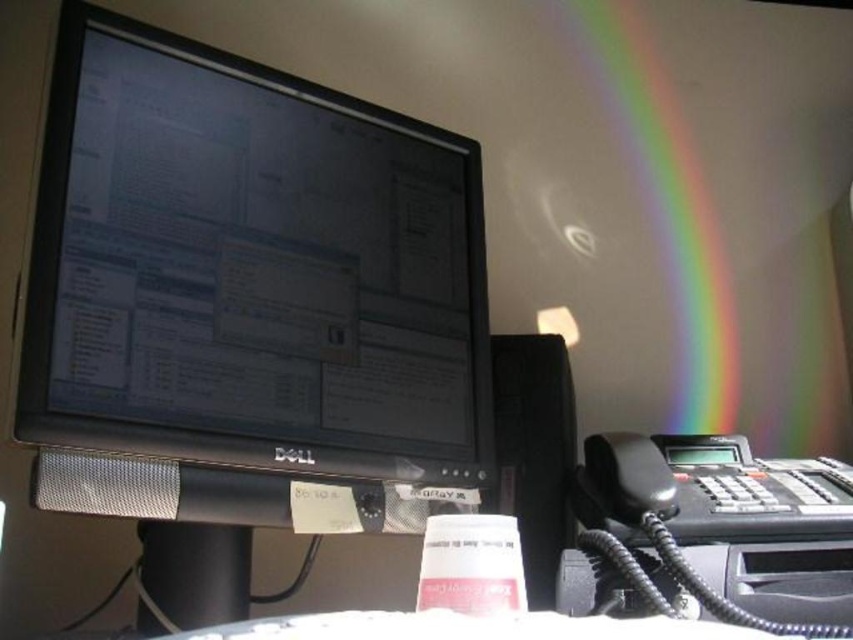
Question: Is black matte monitor at center thinner than rainbow translucent at upper right?

Choices:
 (A) no
 (B) yes

Answer: (A)

Question: Which object appears closest to the camera in this image?

Choices:
 (A) rainbow translucent at upper right
 (B) black matte monitor at center

Answer: (B)

Question: Can you confirm if black matte monitor at center is positioned to the left of rainbow translucent at upper right?

Choices:
 (A) yes
 (B) no

Answer: (A)

Question: Can you confirm if black matte monitor at center is positioned above rainbow translucent at upper right?

Choices:
 (A) yes
 (B) no

Answer: (B)

Question: Among these points, which one is nearest to the camera?

Choices:
 (A) (674, 248)
 (B) (103, 124)

Answer: (B)